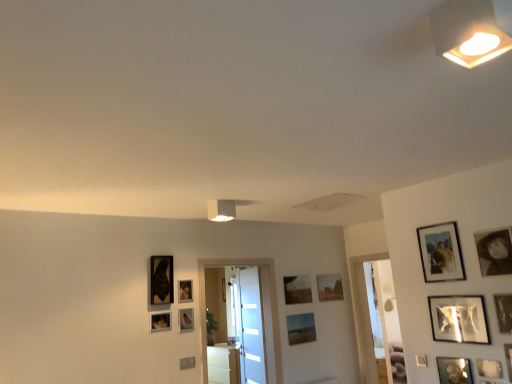
Identify the location of matte glass picture frame at center, arranged as the 6th picture frame when viewed from the left. (301, 328).

How much space does metallic silver picture frame at right, which is the fourteenth picture frame from left to right, occupy vertically?

metallic silver picture frame at right, which is the fourteenth picture frame from left to right, is 9.89 inches in height.

Identify the location of transparent glass door at center, which appears as the first glass door when viewed from the right. The width and height of the screenshot is (512, 384). (379, 316).

Where is `matte wooden picture frame at upper right, marked as the seventh picture frame in a right-to-left arrangement`? The image size is (512, 384). matte wooden picture frame at upper right, marked as the seventh picture frame in a right-to-left arrangement is located at coordinates (441, 252).

I want to click on the 4th picture frame directly above the matte black picture frame at upper right, the fourth picture frame viewed from the front (from a real-world perspective), so click(x=504, y=312).

From the image's perspective, is matte black picture frame at upper right, which is counted as the fourth picture frame, starting from the right, under matte black picture frame at upper right, marked as the thirteenth picture frame in a left-to-right arrangement?

Yes.

Looking at their sizes, would you say matte black picture frame at upper right, the fourth picture frame viewed from the front, is wider or thinner than matte black picture frame at upper right, positioned as the 13th picture frame in back-to-front order?

Considering their sizes, matte black picture frame at upper right, the fourth picture frame viewed from the front, looks slimmer than matte black picture frame at upper right, positioned as the 13th picture frame in back-to-front order.

Is matte black picture frame at upper right, which is counted as the fourth picture frame, starting from the right, positioned with its back to matte black picture frame at upper right, marked as the thirteenth picture frame in a left-to-right arrangement?

That's not correct — matte black picture frame at upper right, which is counted as the fourth picture frame, starting from the right, is not looking away from matte black picture frame at upper right, marked as the thirteenth picture frame in a left-to-right arrangement.

What's the angular difference between matte black picture frame at center, acting as the 10th picture frame starting from the front, and matte black picture frame at lower left, positioned as the thirteenth picture frame in right-to-left order,'s facing directions?

The facing directions of matte black picture frame at center, acting as the 10th picture frame starting from the front, and matte black picture frame at lower left, positioned as the thirteenth picture frame in right-to-left order, are 0.0137 degrees apart.

Is matte black picture frame at center, the 4th picture frame when ordered from left to right, not near matte black picture frame at lower left, positioned as the 2th picture frame in left-to-right order?

matte black picture frame at center, the 4th picture frame when ordered from left to right, is near matte black picture frame at lower left, positioned as the 2th picture frame in left-to-right order, not far away.

Considering the relative positions of matte black picture frame at center, the 11th picture frame when ordered from right to left, and matte black picture frame at lower left, positioned as the thirteenth picture frame in right-to-left order, in the image provided, is matte black picture frame at center, the 11th picture frame when ordered from right to left, to the left of matte black picture frame at lower left, positioned as the thirteenth picture frame in right-to-left order, from the viewer's perspective?

No.

Between matte black picture frame at center, acting as the 10th picture frame starting from the front, and matte black picture frame at lower left, positioned as the 2th picture frame in left-to-right order, which one has larger size?

Bigger between the two is matte black picture frame at center, acting as the 10th picture frame starting from the front.

Is matte glass picture frame at center, which ranks as the ninth picture frame in right-to-left order, located outside matte wooden picture frame at upper right, the 8th picture frame viewed from the back?

matte glass picture frame at center, which ranks as the ninth picture frame in right-to-left order, lies outside matte wooden picture frame at upper right, the 8th picture frame viewed from the back,'s area.

Is point (294, 317) positioned before point (459, 275)?

That is False.

From the image's perspective, relative to matte wooden picture frame at upper right, the 8th picture frame when ordered from left to right, is matte glass picture frame at center, which is counted as the 12th picture frame, starting from the front, above or below?

matte glass picture frame at center, which is counted as the 12th picture frame, starting from the front, is situated lower than matte wooden picture frame at upper right, the 8th picture frame when ordered from left to right, in the image.

Considering the positions of objects matte glass picture frame at center, arranged as the third picture frame when viewed from the back, and matte wooden picture frame at upper right, marked as the seventh picture frame in a right-to-left arrangement, in the image provided, who is more to the left, matte glass picture frame at center, arranged as the third picture frame when viewed from the back, or matte wooden picture frame at upper right, marked as the seventh picture frame in a right-to-left arrangement,?

matte glass picture frame at center, arranged as the third picture frame when viewed from the back.

Is transparent glass door at center, the 2th glass door from the left, aimed at matte black picture frame at center, the 3th picture frame when ordered from left to right?

No.

Between transparent glass door at center, positioned as the second glass door in right-to-left order, and matte black picture frame at center, marked as the eleventh picture frame in a front-to-back arrangement, which one appears on the left side from the viewer's perspective?

matte black picture frame at center, marked as the eleventh picture frame in a front-to-back arrangement.

Who is shorter, transparent glass door at center, the 2th glass door from the left, or matte black picture frame at center, the 3th picture frame when ordered from left to right?

matte black picture frame at center, the 3th picture frame when ordered from left to right, is shorter.

How far apart are transparent glass door at center, the 2th glass door from the left, and matte black picture frame at center, marked as the eleventh picture frame in a front-to-back arrangement?

A distance of 3.81 feet exists between transparent glass door at center, the 2th glass door from the left, and matte black picture frame at center, marked as the eleventh picture frame in a front-to-back arrangement.

From a real-world perspective, is matte wooden picture frame at center, which is the 2th picture frame in back-to-front order, positioned above or below metallic reflective picture frame at right, which is counted as the 5th picture frame, starting from the right?

matte wooden picture frame at center, which is the 2th picture frame in back-to-front order, is situated higher than metallic reflective picture frame at right, which is counted as the 5th picture frame, starting from the right, in the real world.

Between matte wooden picture frame at center, which is the 2th picture frame in back-to-front order, and metallic reflective picture frame at right, which is counted as the 5th picture frame, starting from the right, which one has smaller width?

With smaller width is matte wooden picture frame at center, which is the 2th picture frame in back-to-front order.

Consider the image. In the image, is matte wooden picture frame at center, marked as the 10th picture frame in a right-to-left arrangement, on the left side or the right side of metallic reflective picture frame at right, which is counted as the 5th picture frame, starting from the front?

Based on their positions, matte wooden picture frame at center, marked as the 10th picture frame in a right-to-left arrangement, is located to the left of metallic reflective picture frame at right, which is counted as the 5th picture frame, starting from the front.

From the metallic reflective picture frame at right, which is counted as the tenth picture frame, starting from the left, count the 5th picture frame to the left and point to it. Please provide its 2D coordinates.

[(297, 289)]

Is matte black picture frame at upper right, positioned as the 13th picture frame in back-to-front order, outside of matte black picture frame at center, which is the fifth picture frame in back-to-front order?

That's correct, matte black picture frame at upper right, positioned as the 13th picture frame in back-to-front order, is outside of matte black picture frame at center, which is the fifth picture frame in back-to-front order.

Is matte black picture frame at upper right, positioned as the 13th picture frame in back-to-front order, in front of matte black picture frame at center, the 4th picture frame when ordered from left to right?

Yes, it is.

Looking at this image, from the image's perspective, is matte black picture frame at upper right, which is the 2th picture frame in front-to-back order, above or below matte black picture frame at center, the 4th picture frame when ordered from left to right?

matte black picture frame at upper right, which is the 2th picture frame in front-to-back order, is situated higher than matte black picture frame at center, the 4th picture frame when ordered from left to right, in the image.

Is matte black picture frame at upper right, marked as the thirteenth picture frame in a left-to-right arrangement, wider or thinner than matte black picture frame at center, the 11th picture frame when ordered from right to left?

Considering their sizes, matte black picture frame at upper right, marked as the thirteenth picture frame in a left-to-right arrangement, looks slimmer than matte black picture frame at center, the 11th picture frame when ordered from right to left.

Considering the sizes of objects matte black picture frame at upper right, the fourth picture frame viewed from the front, and matte black picture frame at center, the 11th picture frame when ordered from right to left, in the image provided, who is shorter, matte black picture frame at upper right, the fourth picture frame viewed from the front, or matte black picture frame at center, the 11th picture frame when ordered from right to left,?

matte black picture frame at upper right, the fourth picture frame viewed from the front.

Who is bigger, matte black picture frame at upper right, the fourth picture frame viewed from the front, or matte black picture frame at center, the 11th picture frame when ordered from right to left?

matte black picture frame at center, the 11th picture frame when ordered from right to left.

Considering the positions of objects matte black picture frame at upper right, which is the eleventh picture frame from left to right, and matte black picture frame at center, acting as the 10th picture frame starting from the front, in the image provided, who is more to the left, matte black picture frame at upper right, which is the eleventh picture frame from left to right, or matte black picture frame at center, acting as the 10th picture frame starting from the front,?

From the viewer's perspective, matte black picture frame at center, acting as the 10th picture frame starting from the front, appears more on the left side.

Between point (495, 366) and point (191, 315), which one is positioned in front?

The point (495, 366) is closer to the camera.

Where is `the 8th picture frame above the matte black picture frame at upper right, which is the eleventh picture frame from left to right (from the image's perspective)`? The image size is (512, 384). the 8th picture frame above the matte black picture frame at upper right, which is the eleventh picture frame from left to right (from the image's perspective) is located at coordinates (504, 312).

The width and height of the screenshot is (512, 384). Find the location of `picture frame that is the 2nd object located behind the matte black picture frame at lower left, positioned as the 2th picture frame in left-to-right order`. picture frame that is the 2nd object located behind the matte black picture frame at lower left, positioned as the 2th picture frame in left-to-right order is located at coordinates (186, 319).

Looking at this image, looking at the image, which one is located further to matte black picture frame at lower left, positioned as the thirteenth picture frame in right-to-left order, white plastic light fixture at upper right or transparent glass door at center, positioned as the second glass door in right-to-left order?

white plastic light fixture at upper right is positioned further to the anchor matte black picture frame at lower left, positioned as the thirteenth picture frame in right-to-left order.

Looking at the image, which one is located closer to matte wooden picture frame at upper right, marked as the seventh picture frame in a right-to-left arrangement, black matte picture frame at upper right, the 12th picture frame from the left, or matte black picture frame at left, the 14th picture frame in the right-to-left sequence?

Among the two, black matte picture frame at upper right, the 12th picture frame from the left, is located nearer to matte wooden picture frame at upper right, marked as the seventh picture frame in a right-to-left arrangement.

Estimate the real-world distances between objects in this image. Which object is further from metallic silver picture frame at lower right, which ranks as the ninth picture frame in back-to-front order, matte black picture frame at center, which is the 4th picture frame from back to front, or matte black picture frame at left, the 14th picture frame in the right-to-left sequence?

Among the two, matte black picture frame at left, the 14th picture frame in the right-to-left sequence, is located further to metallic silver picture frame at lower right, which ranks as the ninth picture frame in back-to-front order.

Based on their spatial positions, is metallic reflective picture frame at right, arranged as the 10th picture frame when viewed from the back, or transparent glass door at center, the third glass door positioned from the right, closer to transparent glass door at center, positioned as the second glass door in right-to-left order?

Among the two, transparent glass door at center, the third glass door positioned from the right, is located nearer to transparent glass door at center, positioned as the second glass door in right-to-left order.

Considering their positions, is matte black picture frame at upper right, which is counted as the fourth picture frame, starting from the right, positioned closer to metallic silver picture frame at lower right, which is the 6th picture frame from right to left, than white plastic light fixture at upper right?

matte black picture frame at upper right, which is counted as the fourth picture frame, starting from the right, lies closer to metallic silver picture frame at lower right, which is the 6th picture frame from right to left, than the other object.

Looking at the image, which one is located further to matte wooden picture frame at upper right, placed as the seventh picture frame when sorted from front to back, metallic silver picture frame at lower right, the 6th picture frame from the front, or matte black picture frame at center, marked as the eleventh picture frame in a front-to-back arrangement?

Among the two, matte black picture frame at center, marked as the eleventh picture frame in a front-to-back arrangement, is located further to matte wooden picture frame at upper right, placed as the seventh picture frame when sorted from front to back.

From the image, which object appears to be nearer to white plastic light fixture at upper right, transparent glass door at center, the 2th glass door from the left, or black matte picture frame at upper right, the twelfth picture frame when ordered from back to front?

Among the two, black matte picture frame at upper right, the twelfth picture frame when ordered from back to front, is located nearer to white plastic light fixture at upper right.

Considering their positions, is matte wooden picture frame at center, which is the 13th picture frame from front to back, positioned further to matte black picture frame at left, the 14th picture frame in the right-to-left sequence, than matte black picture frame at center, positioned as the twelfth picture frame in right-to-left order?

Among the two, matte wooden picture frame at center, which is the 13th picture frame from front to back, is located further to matte black picture frame at left, the 14th picture frame in the right-to-left sequence.

At what (x,y) coordinates should I click in order to perform the action: click on glass door located between transparent glass door at center, the third glass door positioned from the right, and transparent glass door at center, which appears as the first glass door when viewed from the right, in the left-right direction. Please return your answer as a coordinate pair (x, y). Looking at the image, I should click on (252, 327).

The image size is (512, 384). I want to click on glass door between transparent glass door at center, the third glass door positioned from the right, and metallic reflective picture frame at right, which is counted as the 5th picture frame, starting from the right, so click(x=252, y=327).

Locate an element on the screen. picture frame situated between matte black picture frame at center, the 3th picture frame when ordered from left to right, and matte wooden picture frame at center, which is the 2th picture frame in back-to-front order, from left to right is located at coordinates (186, 319).

Identify the location of picture frame between black matte picture frame at upper right, the twelfth picture frame when ordered from back to front, and matte black picture frame at upper right, positioned as the 13th picture frame in back-to-front order, in the vertical direction. pos(441,252).